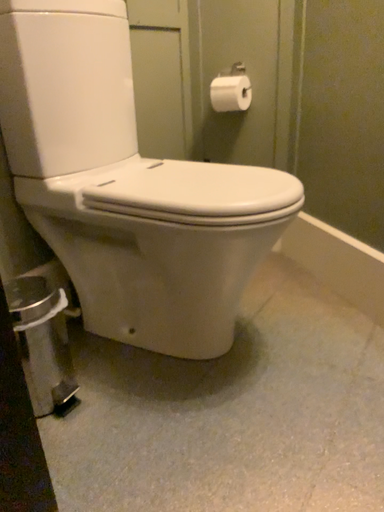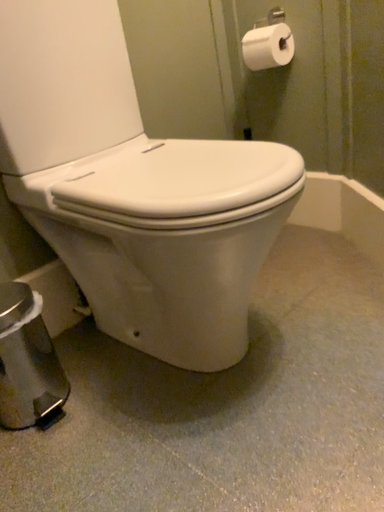
Question: Which way did the camera rotate in the video?

Choices:
 (A) rotated left
 (B) rotated right

Answer: (A)